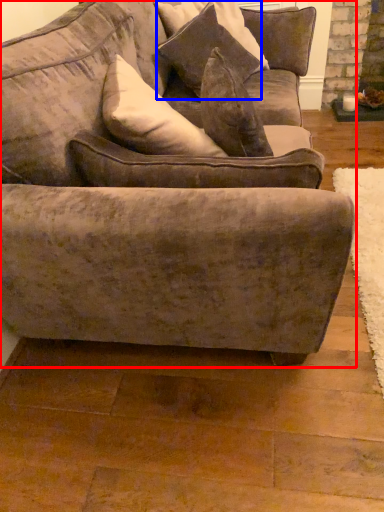
Question: Which object is further to the camera taking this photo, studio couch (highlighted by a red box) or pillow (highlighted by a blue box)?

Choices:
 (A) studio couch
 (B) pillow

Answer: (B)